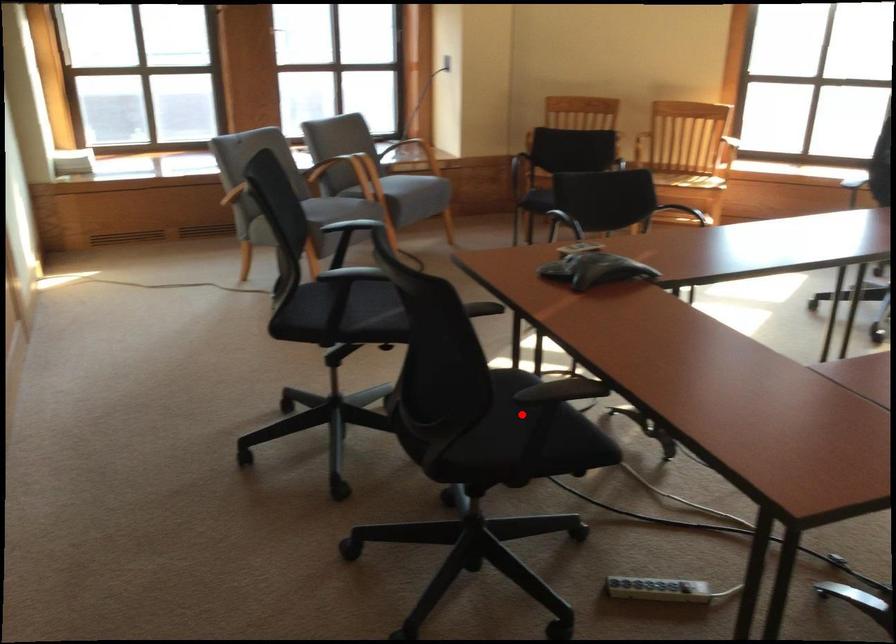
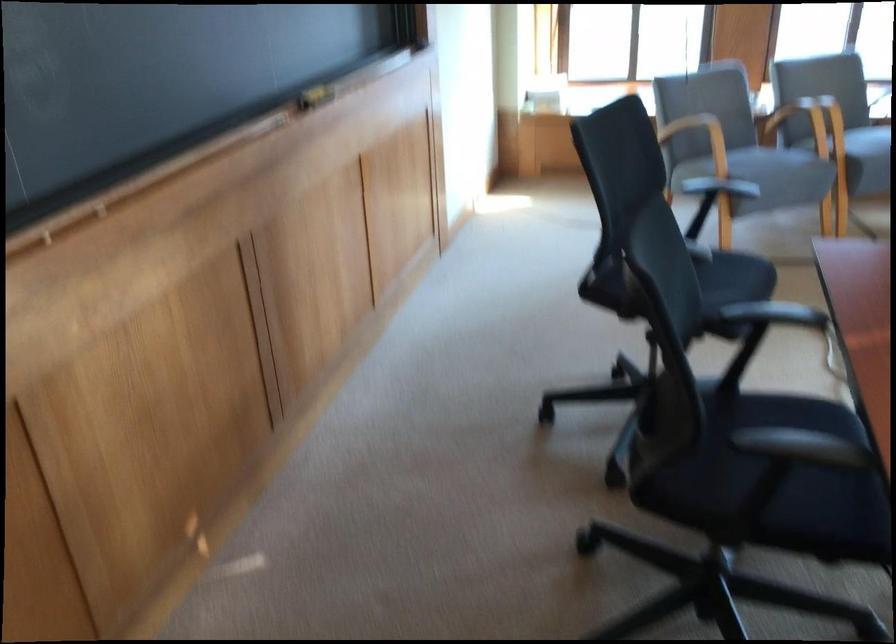
Question: A red point is marked in image1. In image2, is the corresponding 3D point closer to the camera or farther? Reply with the corresponding letter.

Choices:
 (A) The corresponding 3D point is closer.
 (B) The corresponding 3D point is farther.

Answer: (A)